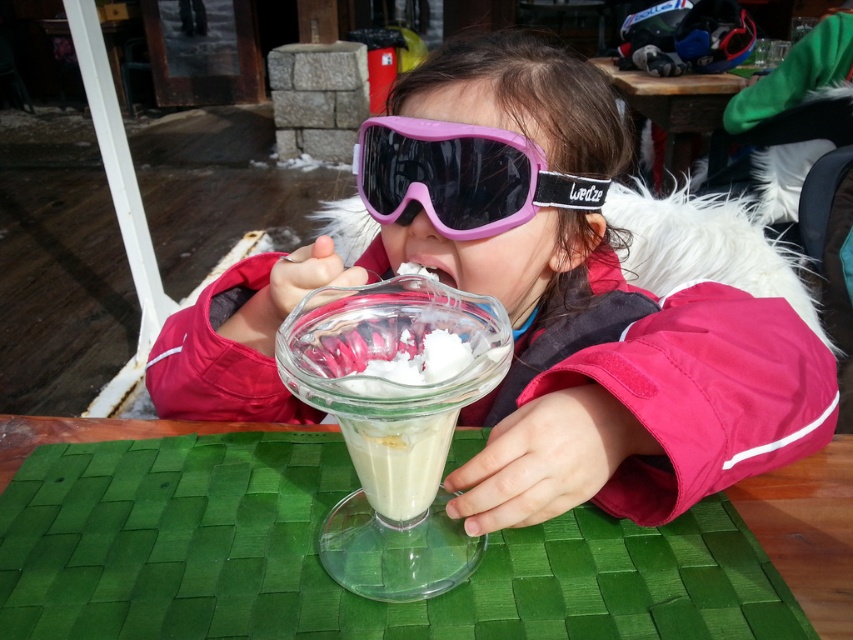
Who is more forward, (844, 545) or (424, 208)?

Point (844, 545) is in front.

Who is more forward, (746, 520) or (602, 193)?

Point (746, 520)

I want to click on green woven mat at center, so click(x=808, y=531).

You are a GUI agent. You are given a task and a screenshot of the screen. Output one action in this format:
    pyautogui.click(x=<x>, y=<y>)
    Task: Click on the pink matte goggles at center
    Image resolution: width=853 pixels, height=640 pixels.
    Given the screenshot: What is the action you would take?
    pyautogui.click(x=527, y=305)

Can you confirm if pink matte goggles at center is positioned to the left of pink matte/silicone goggles at center?

No, pink matte goggles at center is not to the left of pink matte/silicone goggles at center.

Identify the location of pink matte goggles at center. This screenshot has width=853, height=640. (527, 305).

Can you confirm if pink matte goggles at center is shorter than green woven mat at center?

No.

Based on the photo, can you confirm if pink matte goggles at center is positioned to the left of green woven mat at center?

In fact, pink matte goggles at center is to the right of green woven mat at center.

What are the coordinates of `pink matte goggles at center` in the screenshot? It's located at (527, 305).